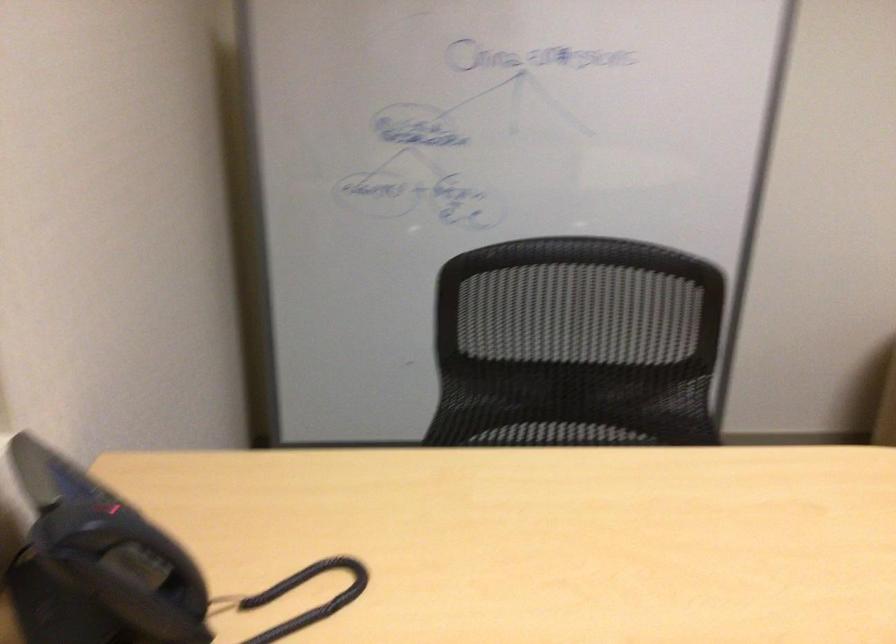
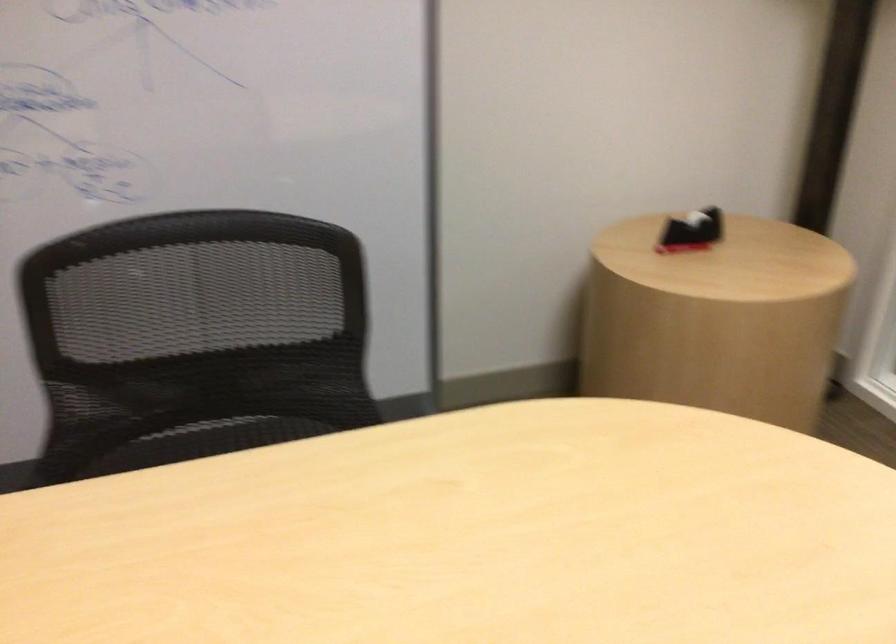
Question: The camera is either moving clockwise (left) or counter-clockwise (right) around the object. The first image is from the beginning of the video and the second image is from the end. Is the camera moving left or right when shooting the video?

Choices:
 (A) Left
 (B) Right

Answer: (A)